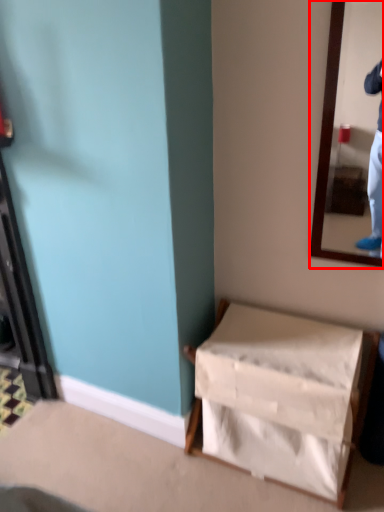
Question: Where is mirror (annotated by the red box) located in relation to furniture in the image?

Choices:
 (A) right
 (B) left

Answer: (A)